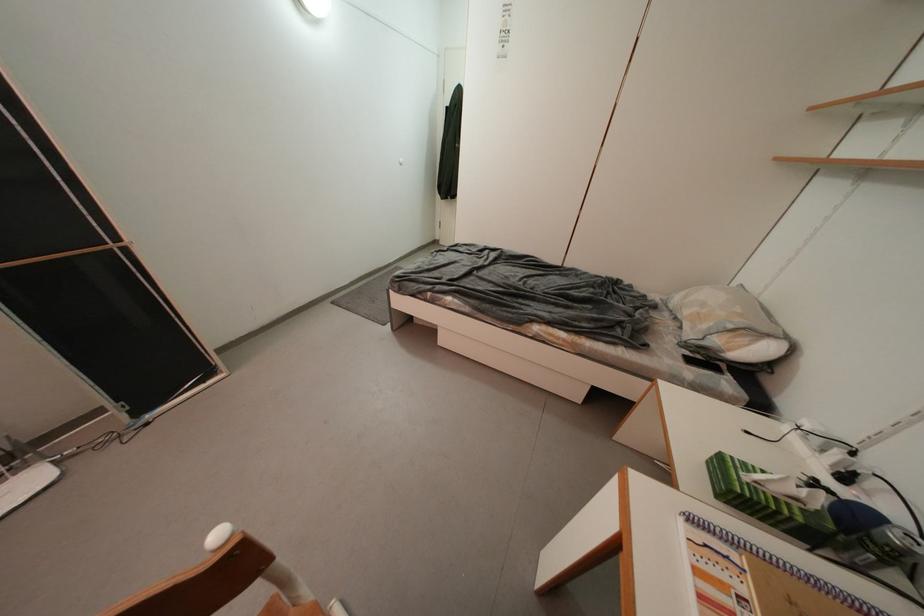
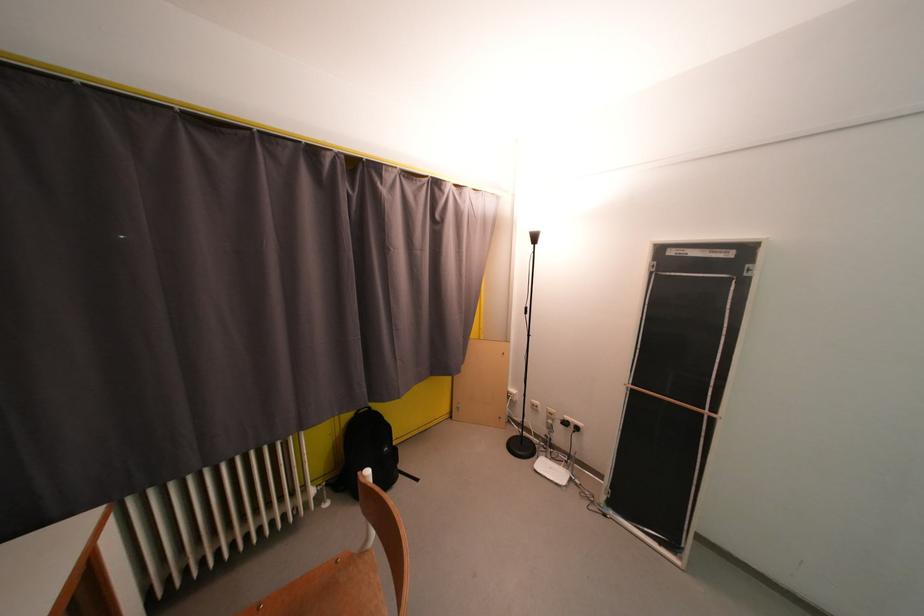
How did the camera likely rotate?

The rotation direction of the camera is left-down.